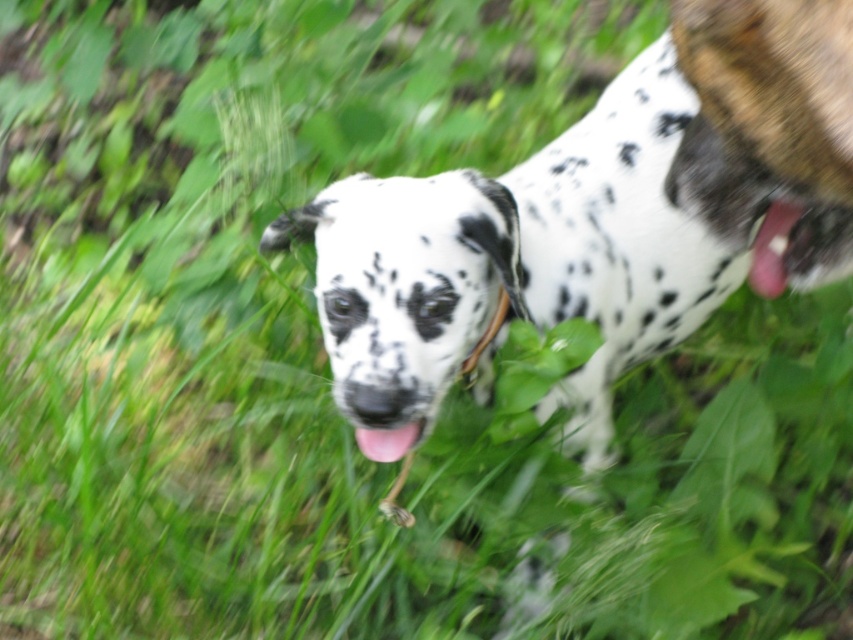
In the scene shown: Does pink leather tongue at center have a lesser width compared to pink glossy tongue at center?

Yes.

Does pink leather tongue at center have a greater height compared to pink glossy tongue at center?

Correct, pink leather tongue at center is much taller as pink glossy tongue at center.

Measure the distance between pink leather tongue at center and camera.

A distance of 3.76 feet exists between pink leather tongue at center and camera.

I want to click on pink leather tongue at center, so point(772,248).

How distant is white-spotted fur dog at center from pink leather tongue at center?

white-spotted fur dog at center and pink leather tongue at center are 22.96 inches apart from each other.

Can you confirm if white-spotted fur dog at center is taller than pink leather tongue at center?

Yes.

Who is more forward, (683, 323) or (770, 248)?

Positioned in front is point (770, 248).

Find the location of `white-spotted fur dog at center`. white-spotted fur dog at center is located at coordinates (595, 218).

Does pink glossy tongue at center have a greater height compared to black leather collar at center?

No.

Between pink glossy tongue at center and black leather collar at center, which one is positioned lower?

pink glossy tongue at center is below.

Which is in front, point (392, 445) or point (496, 310)?

Positioned in front is point (392, 445).

You are a GUI agent. You are given a task and a screenshot of the screen. Output one action in this format:
    pyautogui.click(x=<x>, y=<y>)
    Task: Click on the pink glossy tongue at center
    The image size is (853, 640).
    Given the screenshot: What is the action you would take?
    pyautogui.click(x=387, y=440)